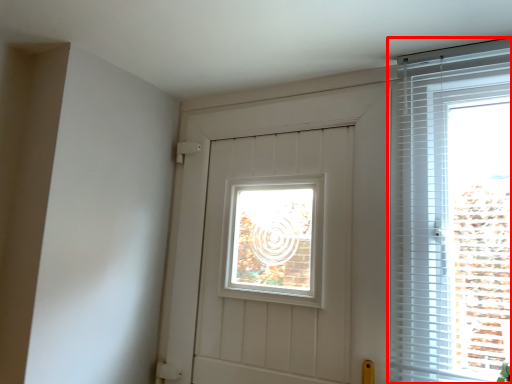
Question: From the image's perspective, what is the correct spatial relationship of window (annotated by the red box) in relation to door?

Choices:
 (A) below
 (B) above

Answer: (B)